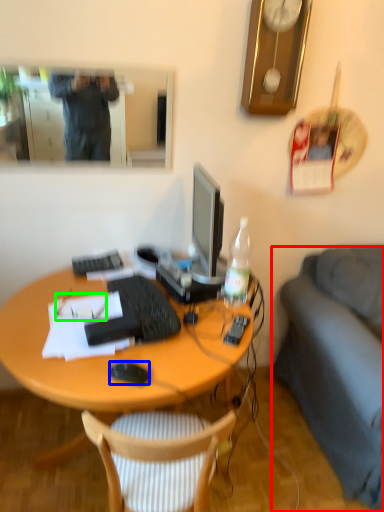
Question: Which object is the farthest from studio couch (highlighted by a red box)? Choose among these: computer mouse (highlighted by a blue box) or glasses (highlighted by a green box).

Choices:
 (A) computer mouse
 (B) glasses

Answer: (B)